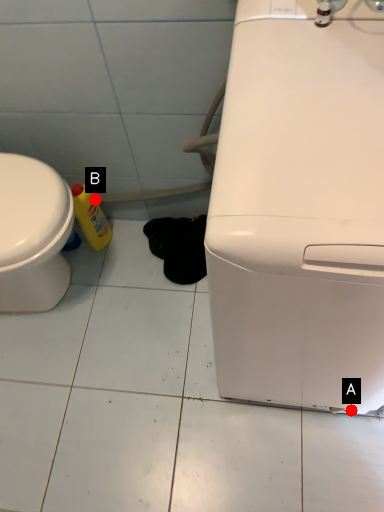
Question: Two points are circled on the image, labeled by A and B beside each circle. Which point is further to the camera?

Choices:
 (A) A is further
 (B) B is further

Answer: (B)